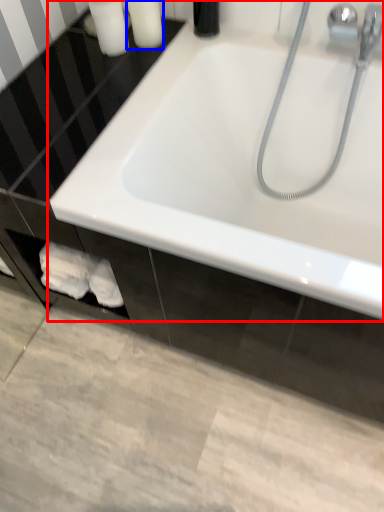
Question: Which object appears closest to the camera in this image, bathtub (highlighted by a red box) or toiletry (highlighted by a blue box)?

Choices:
 (A) bathtub
 (B) toiletry

Answer: (A)